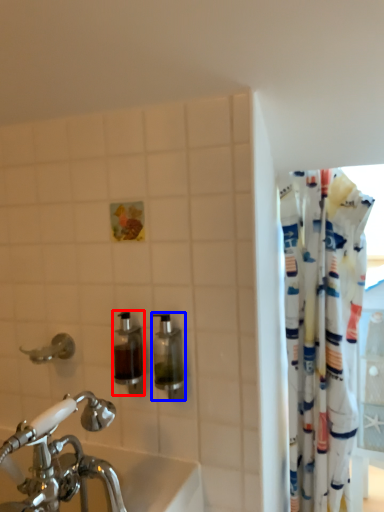
Question: Among these objects, which one is nearest to the camera, soap dispenser (highlighted by a red box) or soap dispenser (highlighted by a blue box)?

Choices:
 (A) soap dispenser
 (B) soap dispenser

Answer: (B)